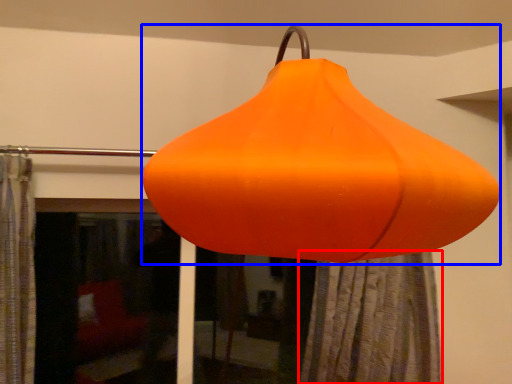
Question: Among these objects, which one is nearest to the camera, shower curtain (highlighted by a red box) or lantern (highlighted by a blue box)?

Choices:
 (A) shower curtain
 (B) lantern

Answer: (B)